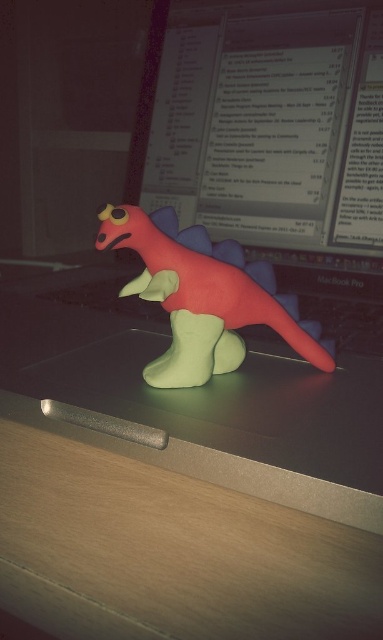
Question: Which object is farther from the camera taking this photo?

Choices:
 (A) wooden table at lower center
 (B) matte plastic computer screen at upper center

Answer: (B)

Question: Is matte plastic computer screen at upper center above rubber-like red dinosaur at center?

Choices:
 (A) yes
 (B) no

Answer: (A)

Question: Is wooden table at lower center above matte plastic computer screen at upper center?

Choices:
 (A) no
 (B) yes

Answer: (A)

Question: Considering the real-world distances, which object is farthest from the wooden table at lower center?

Choices:
 (A) matte plastic computer screen at upper center
 (B) rubber-like red dinosaur at center

Answer: (A)

Question: Is wooden table at lower center below matte plastic computer screen at upper center?

Choices:
 (A) yes
 (B) no

Answer: (A)

Question: Which point is closer to the camera taking this photo?

Choices:
 (A) (202, 308)
 (B) (150, 134)

Answer: (A)